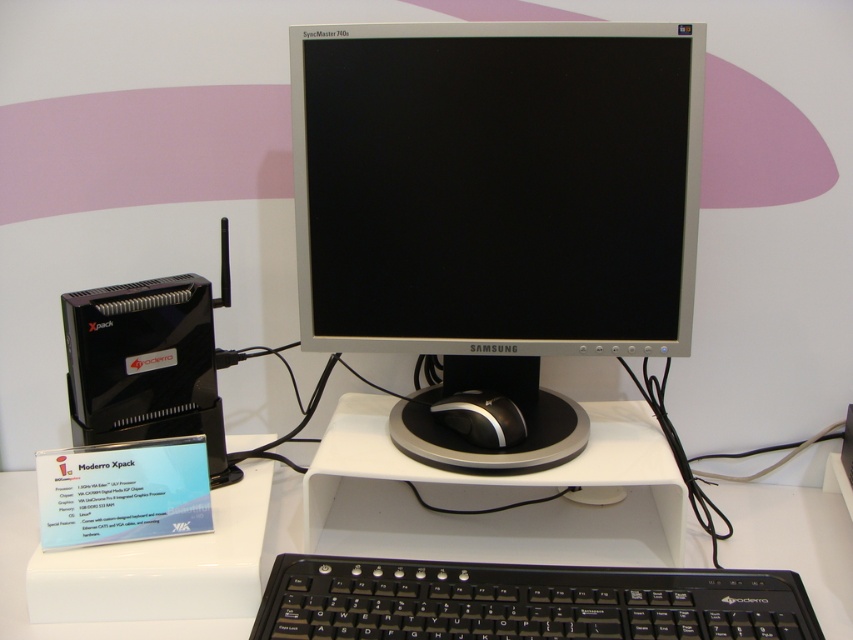
You are setting up a new monitor on the white plastic computer desk at center. The current silver metallic monitor at center is already occupying space. Based on their widths, can the new monitor be placed to the right of the existing one without exceeding the desk width?

The silver metallic monitor at center has a lesser width compared to the white plastic computer desk at center, so there is enough space to place the new monitor to the right of the existing one.

Looking at this image, you are setting up a new computer desk in your room. You have a white plastic computer desk at center that you want to place near the wall with the pink and white abstract design. According to the image, where exactly should you position it?

The white plastic computer desk at center should be positioned at point (793, 541) as indicated in the scene description.

You are setting up a new keyboard and want to ensure it fits on your desk. Given the scene, does the black plastic keyboard at lower center have enough space on the white plastic computer desk at center?

The black plastic keyboard at lower center has a lesser width compared to the white plastic computer desk at center, so it should fit comfortably on the desk.